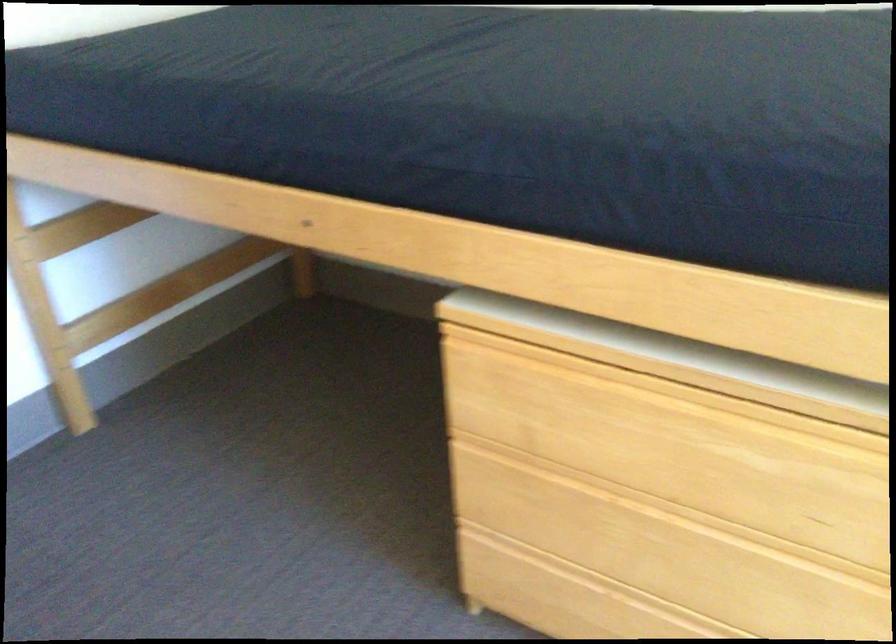
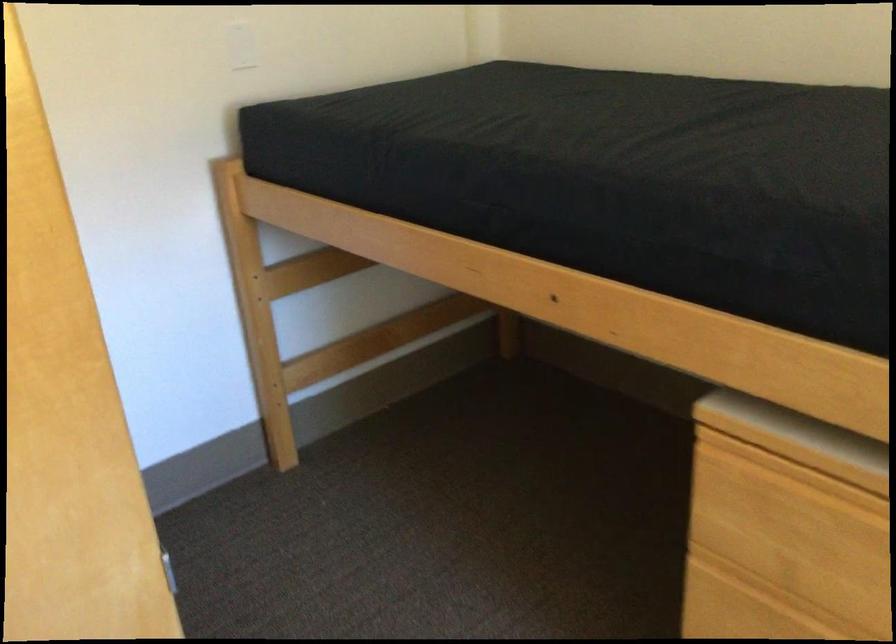
Where in the second image is the point corresponding to point 547,348 from the first image?

(837, 474)